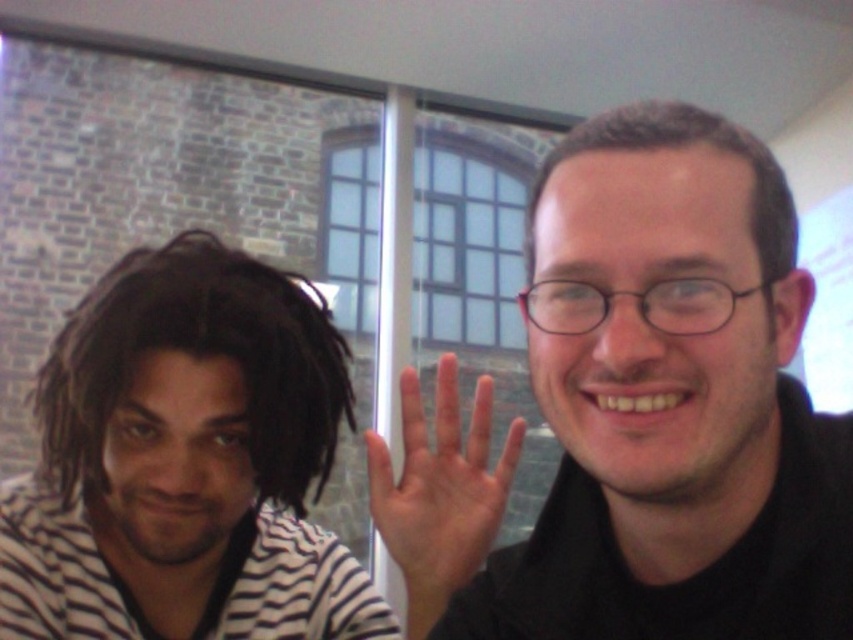
Between dark brown dreadlocks at left and dark brown hair at upper right, which one has more height?

dark brown dreadlocks at left is taller.

Where is `dark brown dreadlocks at left`? dark brown dreadlocks at left is located at coordinates (199, 355).

What are the coordinates of `dark brown dreadlocks at left` in the screenshot? It's located at (199, 355).

Who is more forward, (402, 506) or (560, 160)?

Positioned in front is point (560, 160).

Does skinny white hand at center appear on the right side of dark brown hair at upper right?

Incorrect, skinny white hand at center is not on the right side of dark brown hair at upper right.

The image size is (853, 640). Describe the element at coordinates (440, 486) in the screenshot. I see `skinny white hand at center` at that location.

I want to click on skinny white hand at center, so click(x=440, y=486).

Does dark brown dreadlocks at left have a smaller size compared to skinny white hand at center?

Incorrect, dark brown dreadlocks at left is not smaller in size than skinny white hand at center.

Image resolution: width=853 pixels, height=640 pixels. What do you see at coordinates (199, 355) in the screenshot?
I see `dark brown dreadlocks at left` at bounding box center [199, 355].

Does point (260, 337) come behind point (425, 528)?

No, it is in front of (425, 528).

Where is `dark brown dreadlocks at left`? The height and width of the screenshot is (640, 853). dark brown dreadlocks at left is located at coordinates (199, 355).